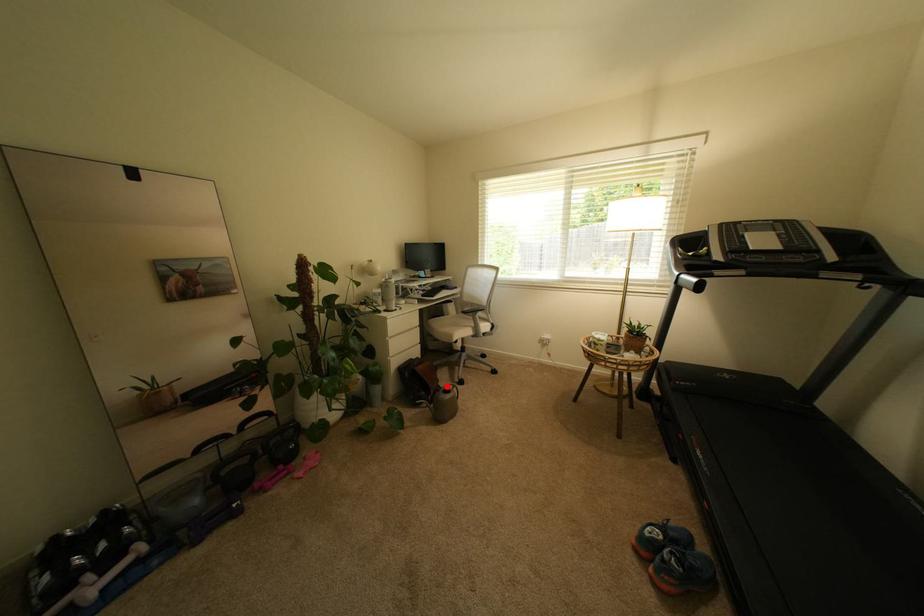
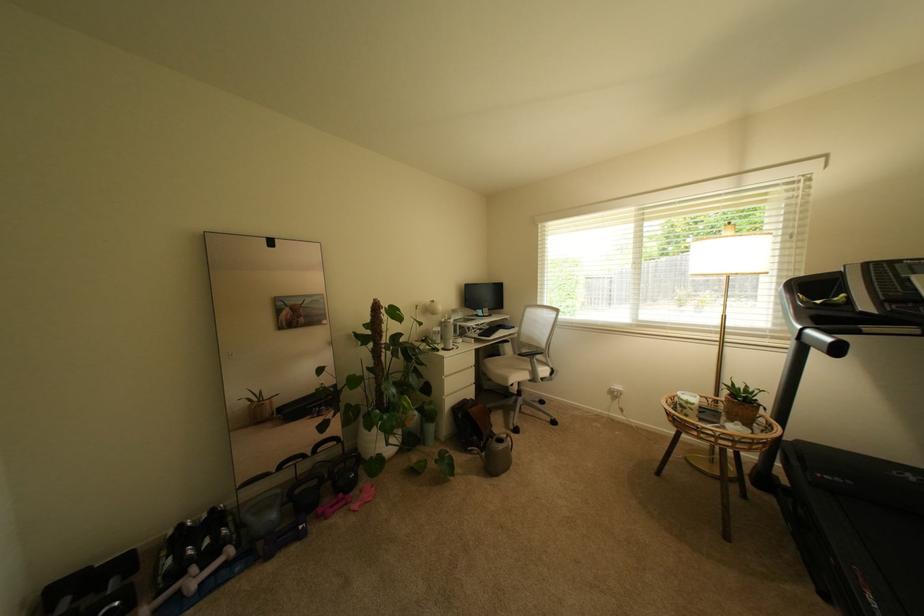
Where in the second image is the point corresponding to the highlighted location from the first image?

(500, 432)